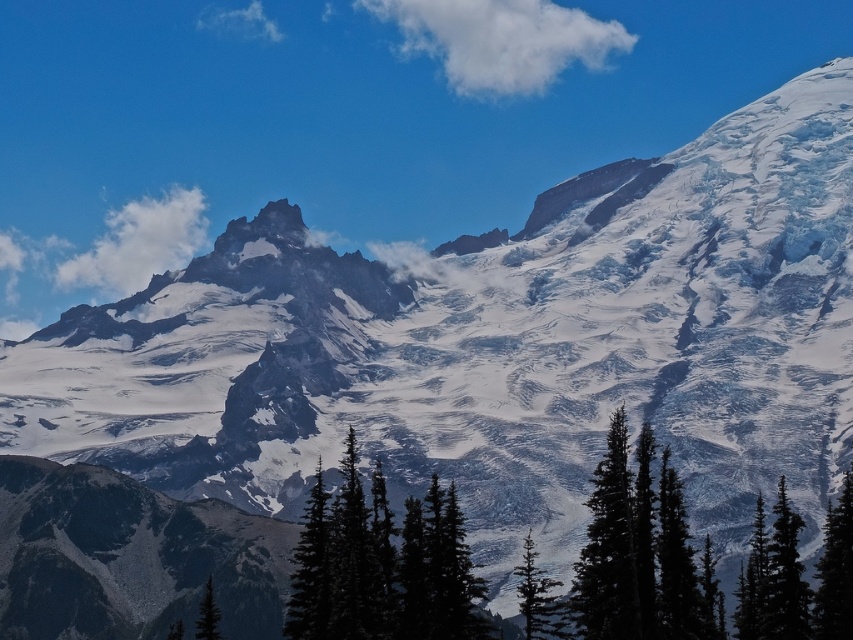
Looking at the mountain landscape, you notice two clouds in the sky. The first is the white fluffy cloud at upper center, and the second is the white fluffy cloud at upper left. Which of these two clouds appears to be wider?

The white fluffy cloud at upper center might be wider than white fluffy cloud at upper left according to the description.

How does the width of the white fluffy cloud at upper center compare to the green matte tree at lower left?

The white fluffy cloud at upper center is wider than the green matte tree at lower left.